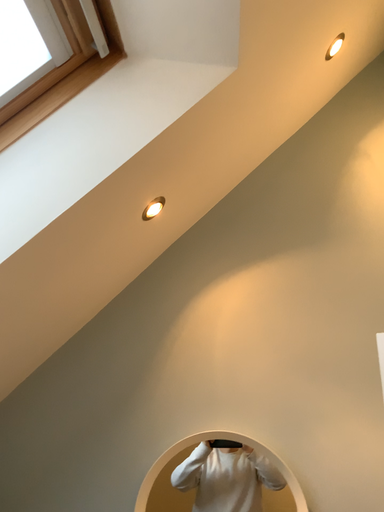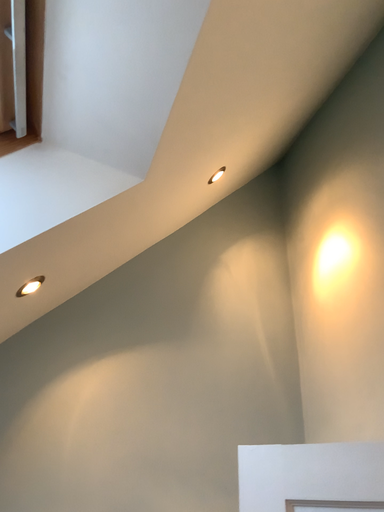
Question: How did the camera likely rotate when shooting the video?

Choices:
 (A) rotated left
 (B) rotated right

Answer: (B)